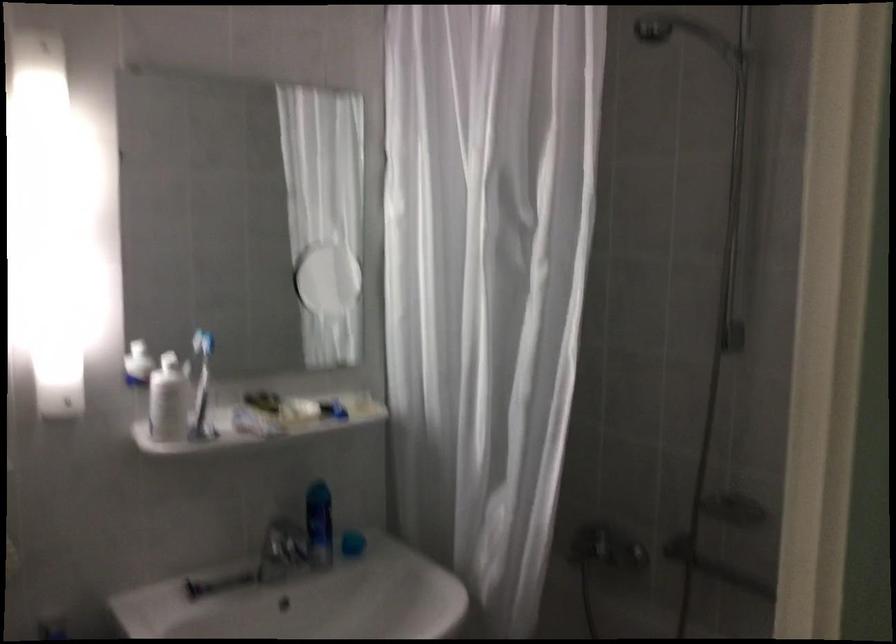
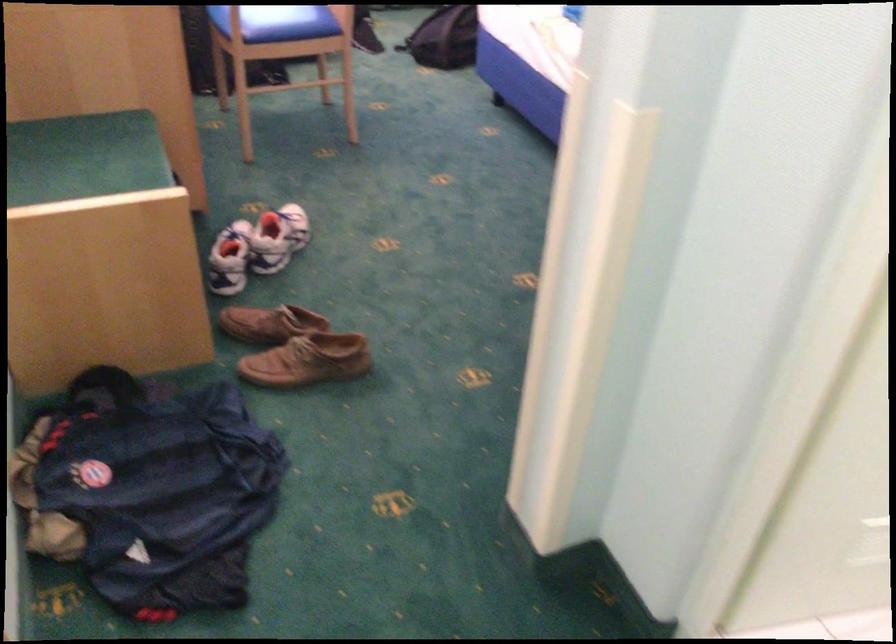
The first image is from the beginning of the video and the second image is from the end. How did the camera likely rotate when shooting the video?

The rotation direction of the camera is left-down.